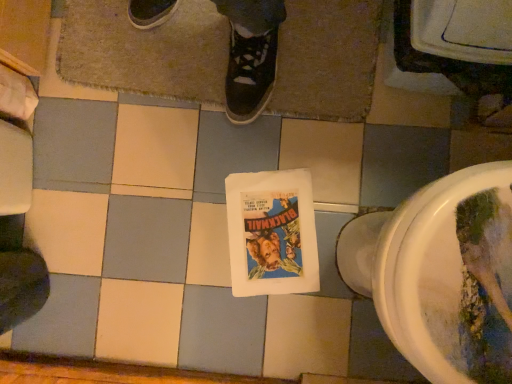
This screenshot has height=384, width=512. What are the coordinates of `free spot below brown textured bath mat at upper center (from a real-world perspective)` in the screenshot? It's located at (210, 56).